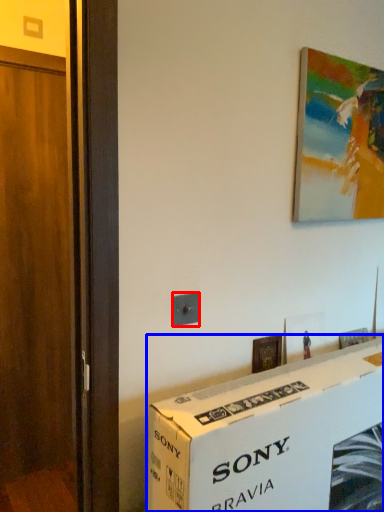
Question: Which of the following is the farthest to the observer, electric outlet (highlighted by a red box) or box (highlighted by a blue box)?

Choices:
 (A) electric outlet
 (B) box

Answer: (A)